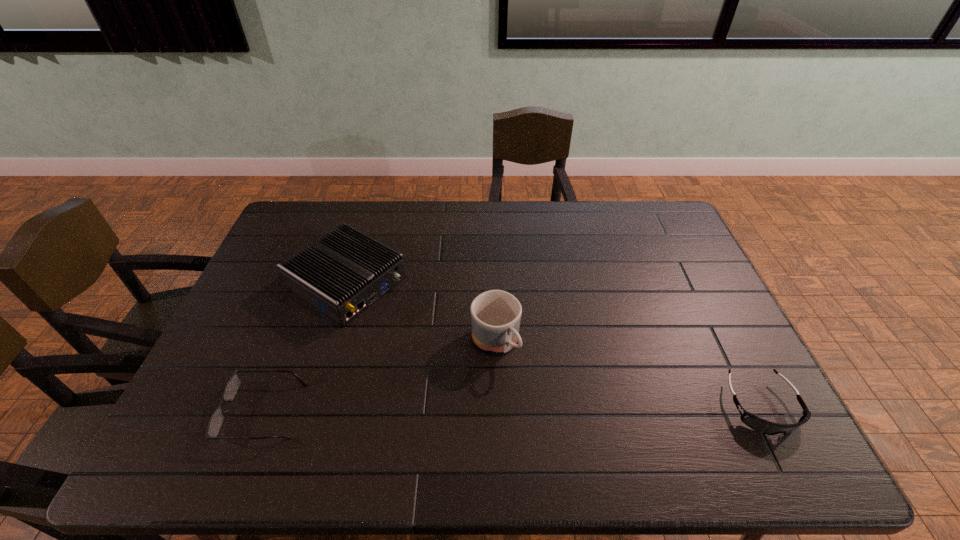
Locate an element on the screen. The width and height of the screenshot is (960, 540). vacant region between the second shortest object and the router is located at coordinates (554, 344).

Locate an element on the screen. The image size is (960, 540). vacant region between the goggles and the mug is located at coordinates (628, 374).

The width and height of the screenshot is (960, 540). Find the location of `object that is the second closest one to the shortest object`. object that is the second closest one to the shortest object is located at coordinates (495, 314).

Where is `object that is the third nearest to the rightmost object`? object that is the third nearest to the rightmost object is located at coordinates (232, 386).